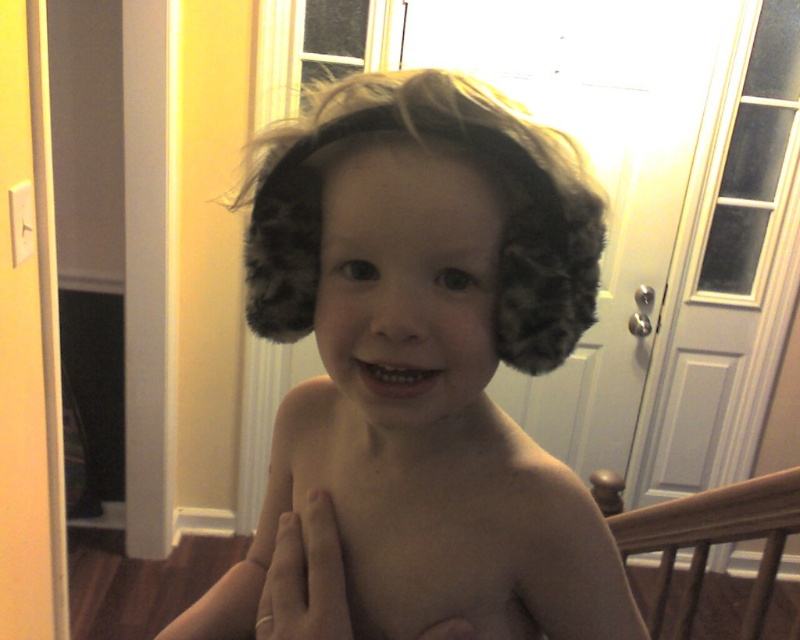
You are a photographer setting up a shot of the child. You need to position a small prop between the brown wooden balustrade at lower right and the gold ring at chest. Based on their positions, which object should the prop be closer to?

The prop should be placed closer to the gold ring at chest because the brown wooden balustrade at lower right is further away from the viewer, meaning the gold ring is nearer in the foreground.

You are a photographer standing in the room and want to take a photo of the brown wooden balustrade at lower right. If your camera is 32.84 inches away from the balustrade, is it within the recommended 36 inches safety distance for close shots?

The brown wooden balustrade at lower right and camera are 32.84 inches apart from each other, so yes, the distance is within the recommended 36 inches safety distance for close shots.

Consider the image. You are a photographer adjusting your camera settings to capture the child in the scene. You notice the smooth skin at center and the gold ring at chest. Which object should you focus on first if you want to prioritize the one closer to the camera?

The gold ring at chest is closer to the camera than the smooth skin at center, so you should focus on the gold ring at chest first.